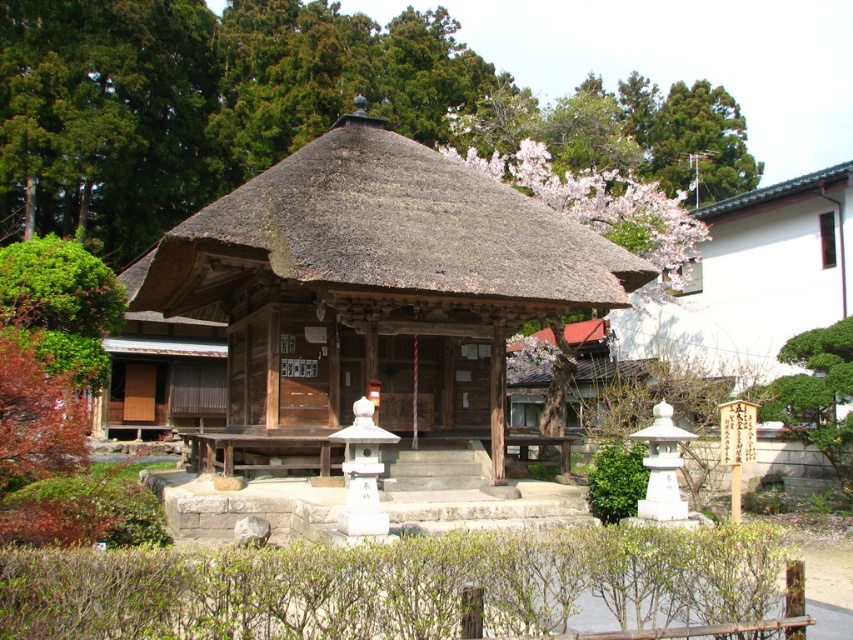
You are a visitor standing at the entrance of the temple. You notice the thatched straw roof at center and the green leafy tree at upper center. Which object is located to the left when facing the temple?

The thatched straw roof at center is positioned on the left side of the green leafy tree at upper center, so when facing the temple, the thatched straw roof at center is to the left of the green leafy tree at upper center.

You are standing in front of a traditional Japanese structure with a thatched roof. There is a point marked at coordinates [389,230]. Which object is located at this point?

The thatched straw roof at center is located at point [389,230].

You are standing at the entrance of the temple and see two points marked in the scene. The first point is at coordinate point (296, 227) and the second point is at coordinate point (703, 166). Which of these points is closer to you?

Point (296, 227) is in front of point (703, 166), so it is closer to you.